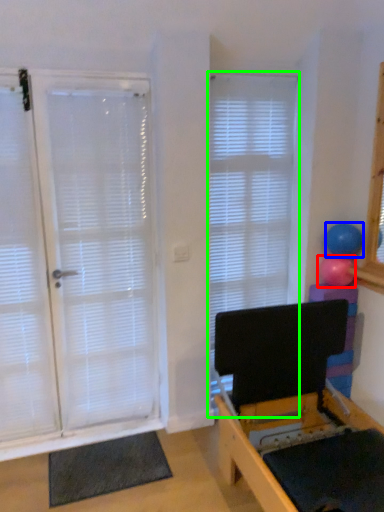
Question: Estimate the real-world distances between objects in this image. Which object is closer to ball (highlighted by a red box), ball (highlighted by a blue box) or window blind (highlighted by a green box)?

Choices:
 (A) ball
 (B) window blind

Answer: (A)